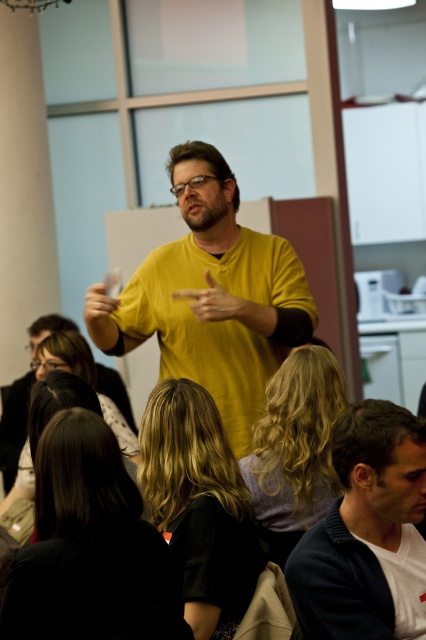
Question: From the image, what is the correct spatial relationship of yellow matte shirt at center in relation to dark blue sweater at lower right?

Choices:
 (A) left
 (B) right

Answer: (A)

Question: Observing the image, what is the correct spatial positioning of yellow matte shirt at center in reference to dark blue sweater at lower right?

Choices:
 (A) below
 (B) above

Answer: (B)

Question: Can you confirm if yellow matte shirt at center is positioned above dark blue sweater at lower right?

Choices:
 (A) yes
 (B) no

Answer: (A)

Question: Which point is farther to the camera?

Choices:
 (A) (399, 499)
 (B) (293, 262)

Answer: (B)